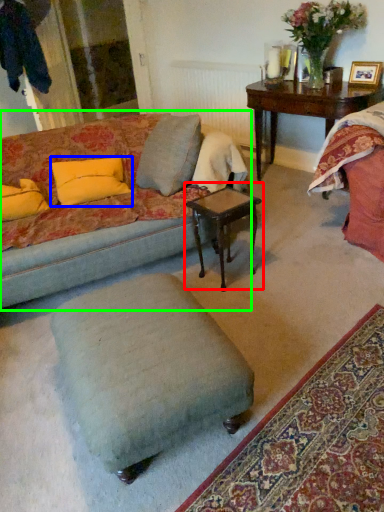
Question: Which object is positioned farthest from coffee table (highlighted by a red box)? Select from pillow (highlighted by a blue box) and studio couch (highlighted by a green box).

Choices:
 (A) pillow
 (B) studio couch

Answer: (A)